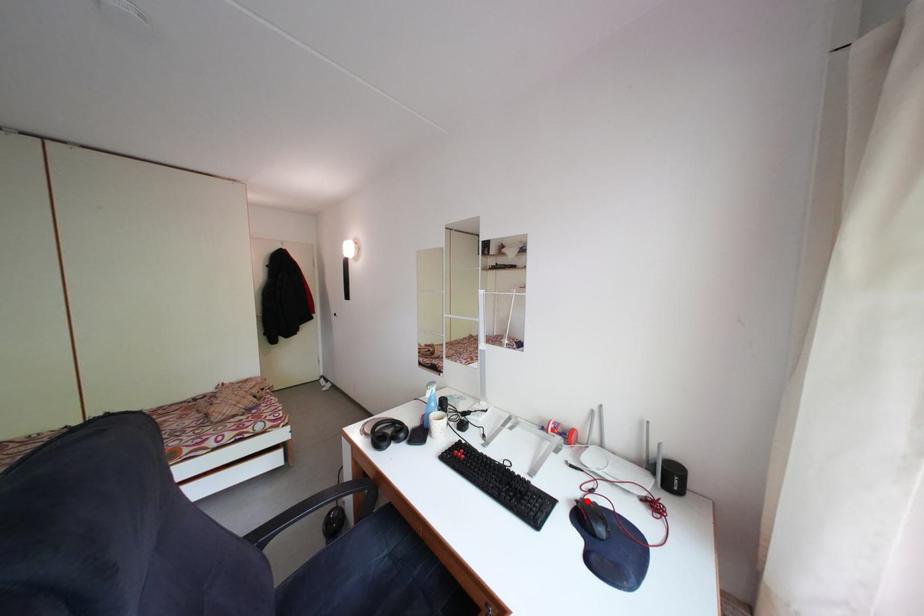
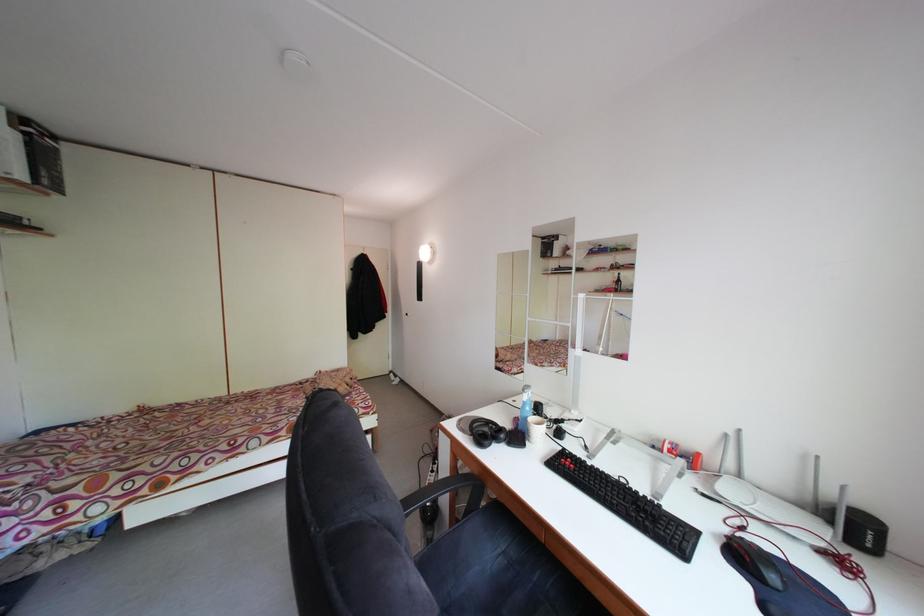
The point at the highlighted location is marked in the first image. Where is the corresponding point in the second image?

(735, 536)